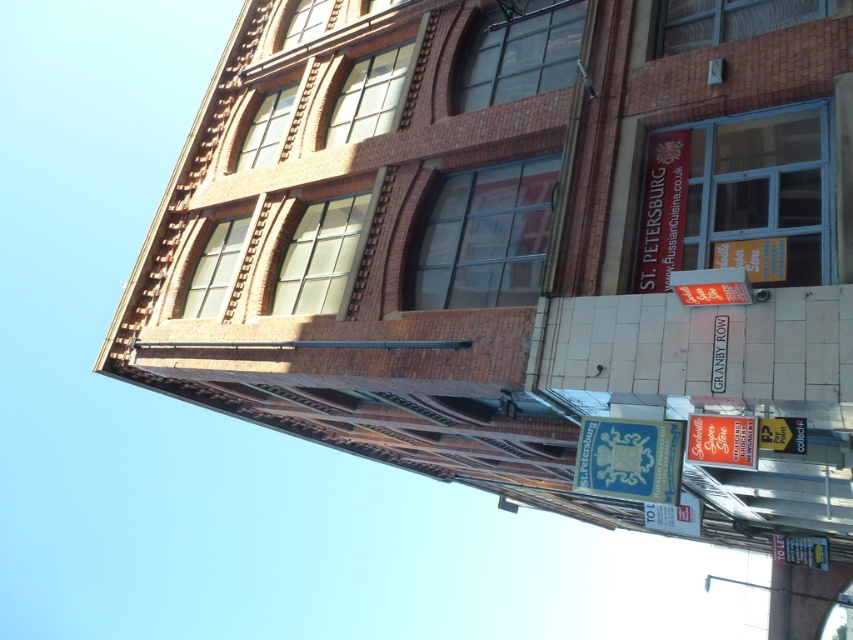
Question: Does matte black sign at upper right have a greater width compared to metallic silver sign at lower right?

Choices:
 (A) no
 (B) yes

Answer: (B)

Question: Which of the following is the closest to the observer?

Choices:
 (A) white plastic sign at lower center
 (B) metallic gold sign at lower right
 (C) metallic silver sign at lower right
 (D) blue paper sign at lower center

Answer: (C)

Question: Is matte black sign at upper right wider than white plastic sign at lower right?

Choices:
 (A) no
 (B) yes

Answer: (A)

Question: Among these objects, which one is farthest from the camera?

Choices:
 (A) metallic silver sign at lower right
 (B) white plastic sign at lower center
 (C) matte black sign at upper right

Answer: (C)

Question: Is white plastic sign at lower center below metallic silver sign at lower right?

Choices:
 (A) no
 (B) yes

Answer: (B)

Question: Which point appears closest to the camera in this image?

Choices:
 (A) (683, 529)
 (B) (704, 419)
 (C) (793, 541)
 (D) (640, 257)

Answer: (B)